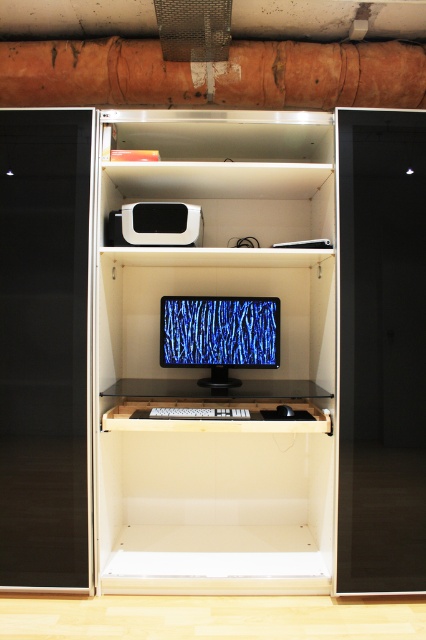
You are standing in front of the workspace cabinet described in the scene. A specific point labeled as point (244, 564) is marked on the cabinet. If you want to reach this point without moving your feet, can you comfortably do so? Please explain your reasoning based on the distance provided.

The point (244, 564) is 8.50 feet away from the viewer. Since the average comfortable reaching distance for most adults is about 2 to 3 feet, reaching 8.50 feet without moving your feet would be difficult and uncomfortable. Therefore, it is not possible to comfortably reach this point without moving.

You are organizing the workspace and need to place a new keyboard. The keyboard requires a flat surface that is at least 50 cm wide. The black glossy monitor at center and the matte black monitor at center are both in the cabinet. Which monitor has a surface below it that can accommodate the keyboard?

The matte black monitor at center has a surface below it because the black glossy monitor at center is located below it, so the space beneath the matte black monitor at center can hold the keyboard.

You are a delivery person who needs to place a small package on the cabinet in the image. The cabinet has two specific points marked as point 1 and point 2. Point 1 is at coordinate (x=192, y=122) and point 2 is at coordinate (x=201, y=330). Which point is closer to you so that you can easily reach it without moving your position?

Point 1 is closer to the viewer than point 2, so you can easily reach point 1 without moving your position.